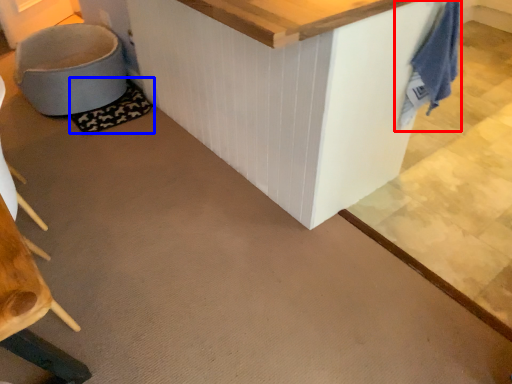
Question: Which of the following is the closest to the observer, laundry (highlighted by a red box) or mat (highlighted by a blue box)?

Choices:
 (A) laundry
 (B) mat

Answer: (A)